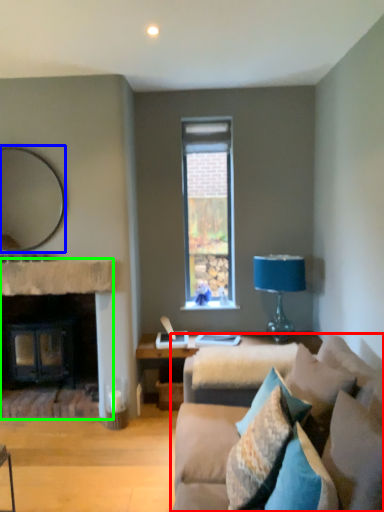
Question: Considering the real-world distances, which object is farthest from studio couch (highlighted by a red box)? mirror (highlighted by a blue box) or fireplace (highlighted by a green box)?

Choices:
 (A) mirror
 (B) fireplace

Answer: (A)